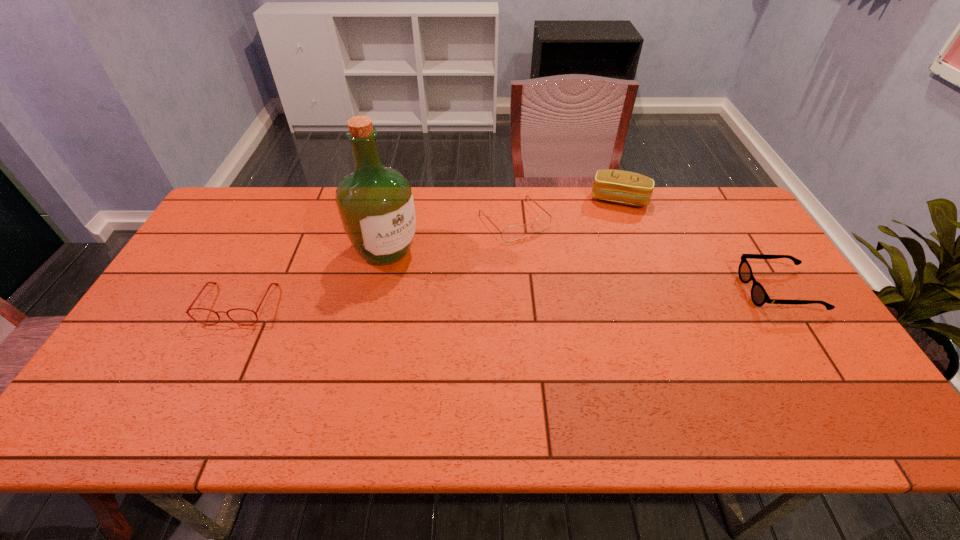
Where is `vacant space on the desktop that is between the leftmost spectacles and the rightmost spectacles and is positioned on the front-facing side of the farthest spectacles`? The width and height of the screenshot is (960, 540). vacant space on the desktop that is between the leftmost spectacles and the rightmost spectacles and is positioned on the front-facing side of the farthest spectacles is located at coordinates (582, 295).

Locate an element on the screen. vacant space on the desktop that is between the leftmost spectacles and the rightmost object and is positioned on the front-facing side of the tallest object is located at coordinates (446, 299).

What are the coordinates of `vacant spot on the desktop that is between the leftmost object and the rightmost object and is positioned on the zipper side of the second object from right to left` in the screenshot? It's located at (593, 295).